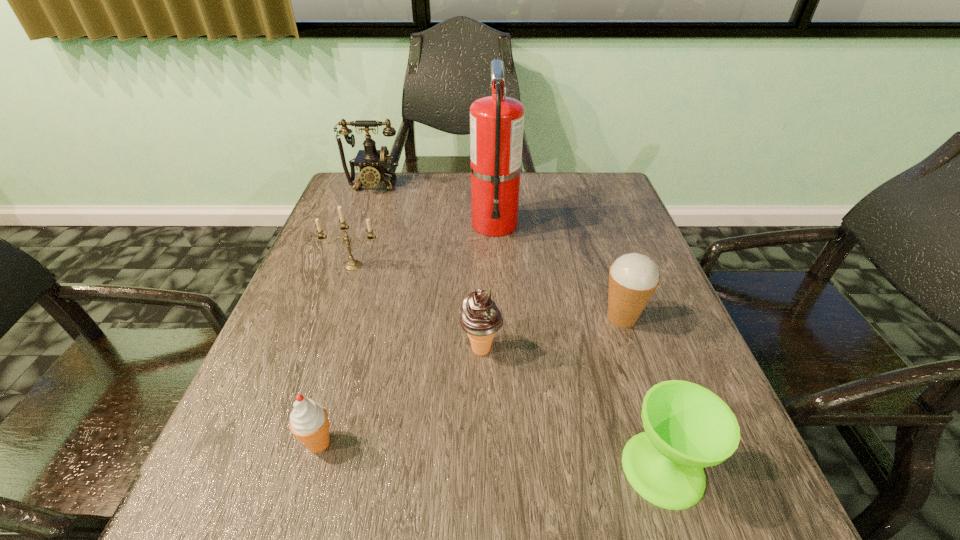
You are a GUI agent. You are given a task and a screenshot of the screen. Output one action in this format:
    pyautogui.click(x=<x>, y=<y>)
    Task: Click on the vacant space that's between the fire extinguisher and the rightmost icecream
    The width and height of the screenshot is (960, 540).
    Given the screenshot: What is the action you would take?
    pyautogui.click(x=558, y=271)

At what (x,y) coordinates should I click in order to perform the action: click on object that is the fourth closest one to the nearest icecream. Please return your answer as a coordinate pair (x, y). The image size is (960, 540). Looking at the image, I should click on (633, 278).

Identify the location of object that ranks as the third closest to the second icecream from right to left. (309, 422).

Identify which icecream is located as the nearest to the second icecream from right to left. Please provide its 2D coordinates. Your answer should be formatted as a tuple, i.e. [(x, y)], where the tuple contains the x and y coordinates of a point satisfying the conditions above.

[(633, 278)]

Point out which icecream is positioned as the third nearest to the telephone. Please provide its 2D coordinates. Your answer should be formatted as a tuple, i.e. [(x, y)], where the tuple contains the x and y coordinates of a point satisfying the conditions above.

[(309, 422)]

Where is `free space that satisfies the following two spatial constraints: 1. at the nozzle of the wineglass; 2. on the right side of the tallest object`? free space that satisfies the following two spatial constraints: 1. at the nozzle of the wineglass; 2. on the right side of the tallest object is located at coordinates (505, 468).

Where is `vacant region that satisfies the following two spatial constraints: 1. on the rotary dial of the candle; 2. on the right side of the farthest object`? Image resolution: width=960 pixels, height=540 pixels. vacant region that satisfies the following two spatial constraints: 1. on the rotary dial of the candle; 2. on the right side of the farthest object is located at coordinates (345, 266).

At what (x,y) coordinates should I click in order to perform the action: click on vacant position in the image that satisfies the following two spatial constraints: 1. on the rotary dial of the telephone; 2. on the right side of the third farthest object. Please return your answer as a coordinate pair (x, y). The image size is (960, 540). Looking at the image, I should click on click(345, 266).